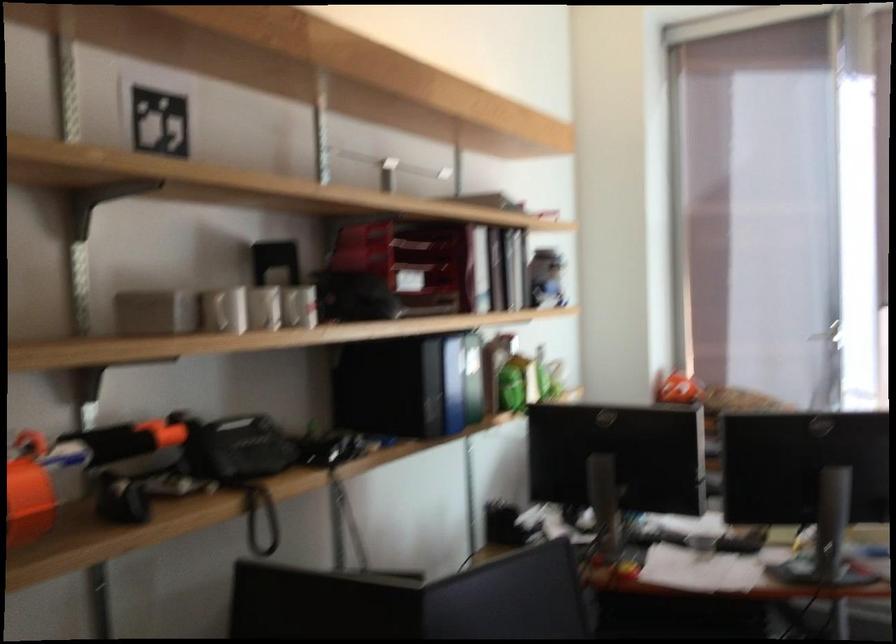
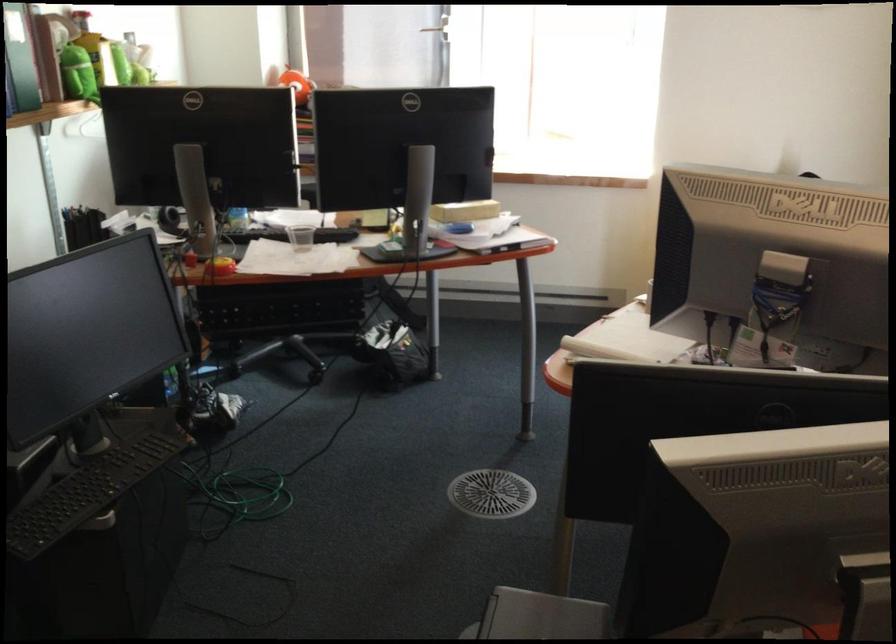
Locate, in the second image, the point that corresponds to pixel 701 552 in the first image.

(300, 238)